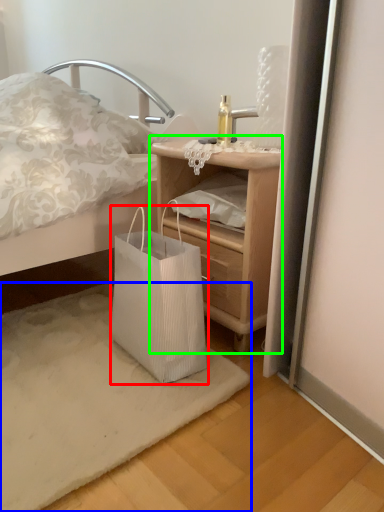
Question: Considering the real-world distances, which object is closest to bag (highlighted by a red box)? mat (highlighted by a blue box) or nightstand (highlighted by a green box).

Choices:
 (A) mat
 (B) nightstand

Answer: (A)